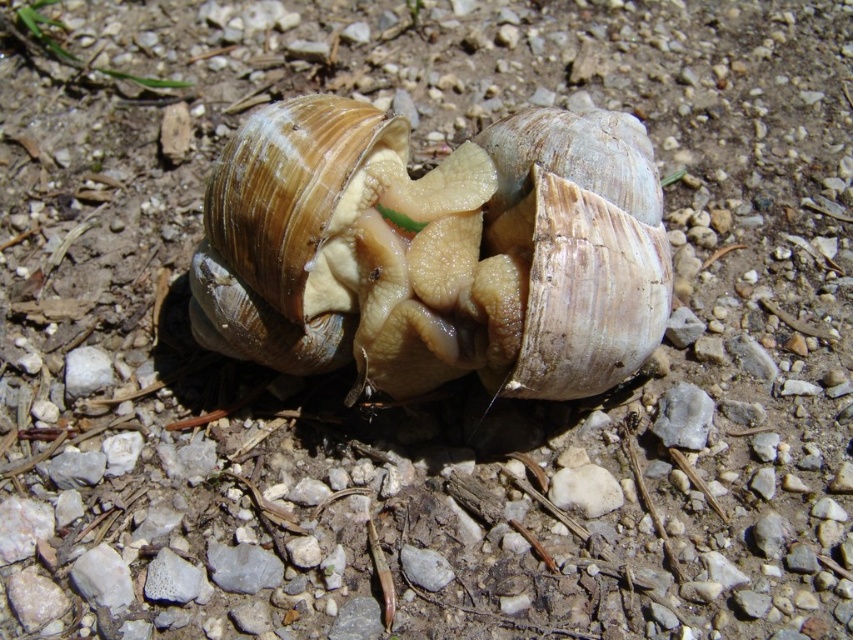
Question: Which point is closer to the camera taking this photo?

Choices:
 (A) (424, 355)
 (B) (601, 312)

Answer: (B)

Question: Does brown textured shell at center have a greater width compared to matte brown shell at center?

Choices:
 (A) yes
 (B) no

Answer: (A)

Question: Is brown textured shell at center bigger than matte brown shell at center?

Choices:
 (A) no
 (B) yes

Answer: (B)

Question: In this image, where is brown textured shell at center located relative to matte brown shell at center?

Choices:
 (A) right
 (B) left

Answer: (B)

Question: Which point appears farthest from the camera in this image?

Choices:
 (A) (637, 324)
 (B) (350, 296)

Answer: (B)